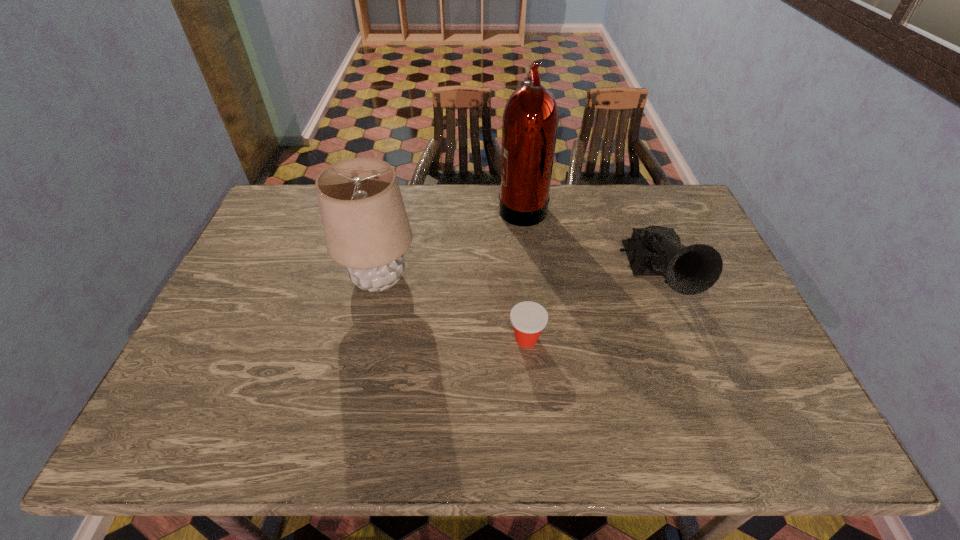
The width and height of the screenshot is (960, 540). I want to click on free space between the nearest object and the leftmost object, so click(x=453, y=309).

The width and height of the screenshot is (960, 540). What are the coordinates of `free point between the lampshade and the rightmost object` in the screenshot? It's located at (517, 279).

Where is `the second closest object to the third shortest object`? Image resolution: width=960 pixels, height=540 pixels. the second closest object to the third shortest object is located at coordinates (530, 123).

I want to click on object that ranks as the second closest to the fire extinguisher, so click(x=366, y=227).

Find the location of a particular element. This screenshot has height=540, width=960. free spot that satisfies the following two spatial constraints: 1. on the front-facing side of the fire extinguisher; 2. on the front side of the shortest object is located at coordinates (537, 339).